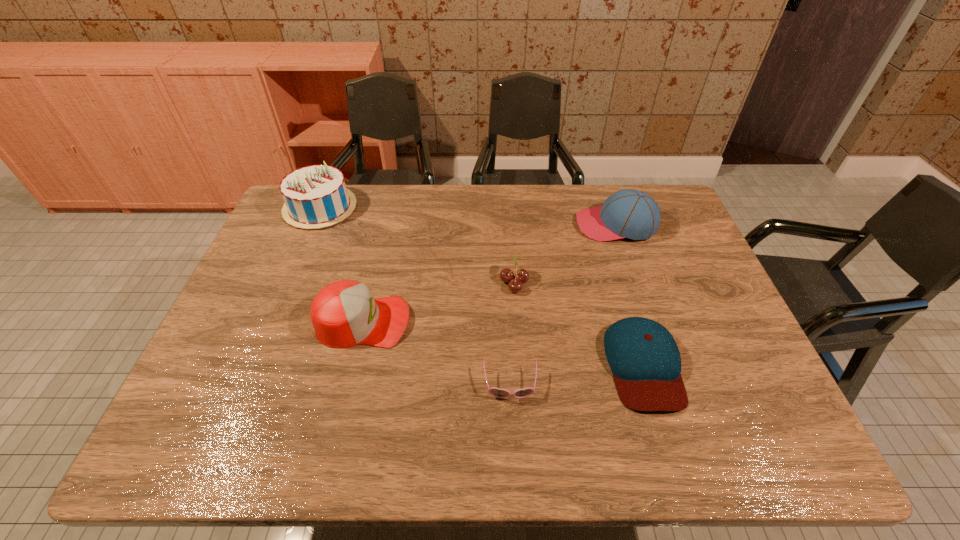
Point out which baseball cap is positioned as the nearest to the farthest baseball cap. Please provide its 2D coordinates. Your answer should be formatted as a tuple, i.e. [(x, y)], where the tuple contains the x and y coordinates of a point satisfying the conditions above.

[(644, 358)]

The width and height of the screenshot is (960, 540). In order to click on vacant space that satisfies the following two spatial constraints: 1. on the leaves of the third farthest object; 2. on the front-facing side of the sunglasses in this screenshot , I will do `click(521, 386)`.